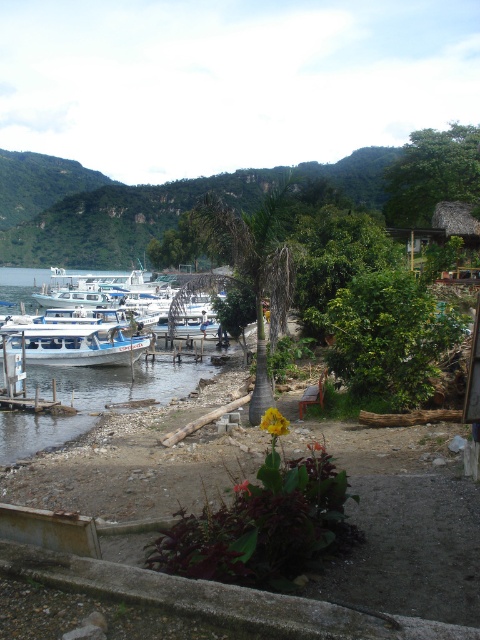
Does white glossy boat at lower left lie behind wooden bench at lower center?

Yes, white glossy boat at lower left is further from the viewer.

Describe the element at coordinates (73, 344) in the screenshot. Image resolution: width=480 pixels, height=640 pixels. I see `white glossy boat at lower left` at that location.

Who is more distant from viewer, (x=100, y=337) or (x=325, y=371)?

The point (x=100, y=337) is more distant.

Identify the location of white glossy boat at lower left. point(73,344).